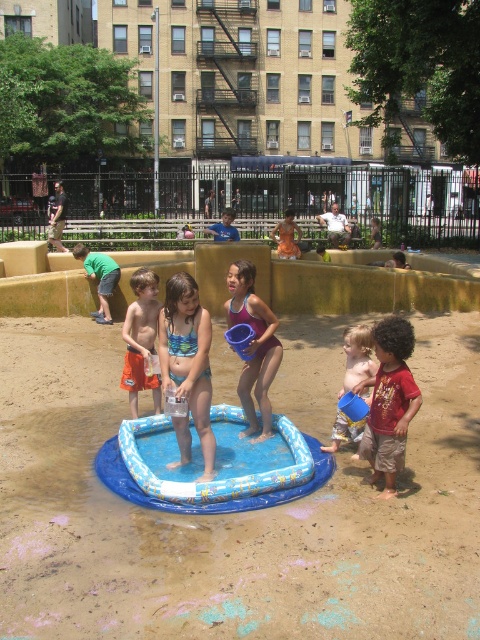
Is point (349, 387) positioned behind point (289, 209)?

No.

Between point (348, 426) and point (283, 257), which one is positioned behind?

Positioned behind is point (283, 257).

Is point (338, 445) more distant than point (297, 228)?

No, (338, 445) is in front of (297, 228).

Locate an element on the screen. The height and width of the screenshot is (640, 480). blue plastic bucket at center is located at coordinates (357, 356).

Is blue printed swimsuit at center to the left of orange fabric dress at center from the viewer's perspective?

Yes, blue printed swimsuit at center is to the left of orange fabric dress at center.

Is blue printed swimsuit at center smaller than orange fabric dress at center?

Actually, blue printed swimsuit at center might be larger than orange fabric dress at center.

I want to click on blue printed swimsuit at center, so click(x=188, y=365).

Locate an element on the screen. This screenshot has width=480, height=640. blue printed swimsuit at center is located at coordinates (188, 365).

Is brown cotton shorts at lower right above blue plastic bucket at center?

No.

Between point (377, 394) and point (349, 339), which one is positioned behind?

The point (349, 339) is more distant.

Where is `brown cotton shorts at lower right`? The width and height of the screenshot is (480, 640). brown cotton shorts at lower right is located at coordinates (389, 401).